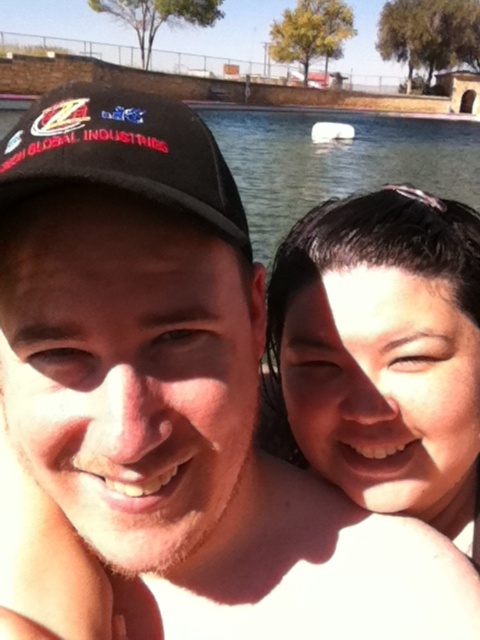
You are a photographer trying to capture a closeup of the smooth skin face at upper right. The camera you are using has a rectangular viewfinder with a fixed size. The point at coordinates point (384, 352) is the center of the smooth skin face at upper right. The photographer wants to know if the entire face can fit within the viewfinder. The viewfinder has a width of 0.6 and a height of 0.6 in the same coordinate system. Can the photographer capture the entire face within the viewfinder?

The point (384, 352) is the center of the smooth skin face at upper right. The viewfinder has a width and height of 0.6, so the viewfinder extends 0.3 units in all directions from the center. Since the face is centered at (384, 352), the edges of the viewfinder would be from 0.25 to 0.85 in the x direction and 0.502 to 1.102 in the y direction. However, the image coordinate system typically ranges from 0 to 1, so the upper y limit of 1.102 exceeds the maximum possible value of 1. Therefore, part of the